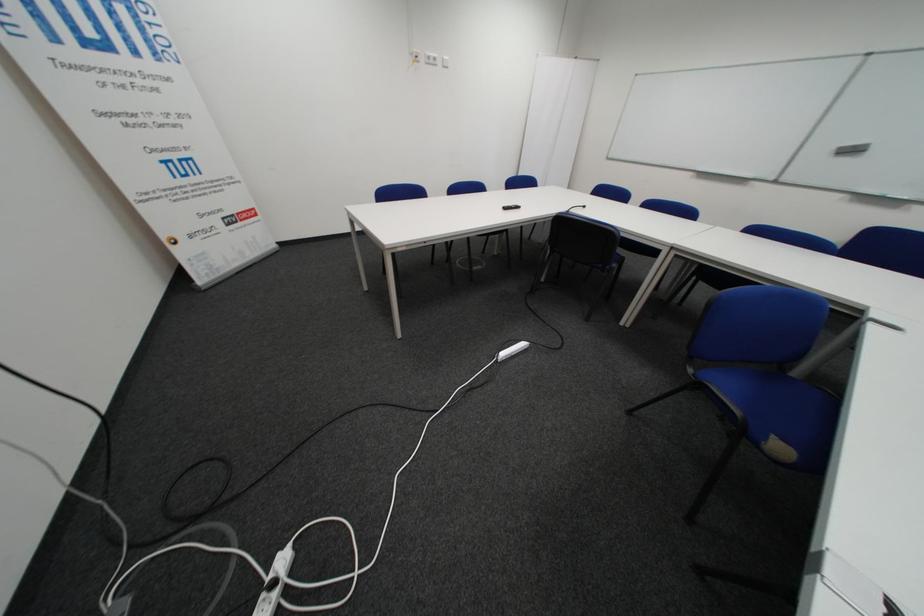
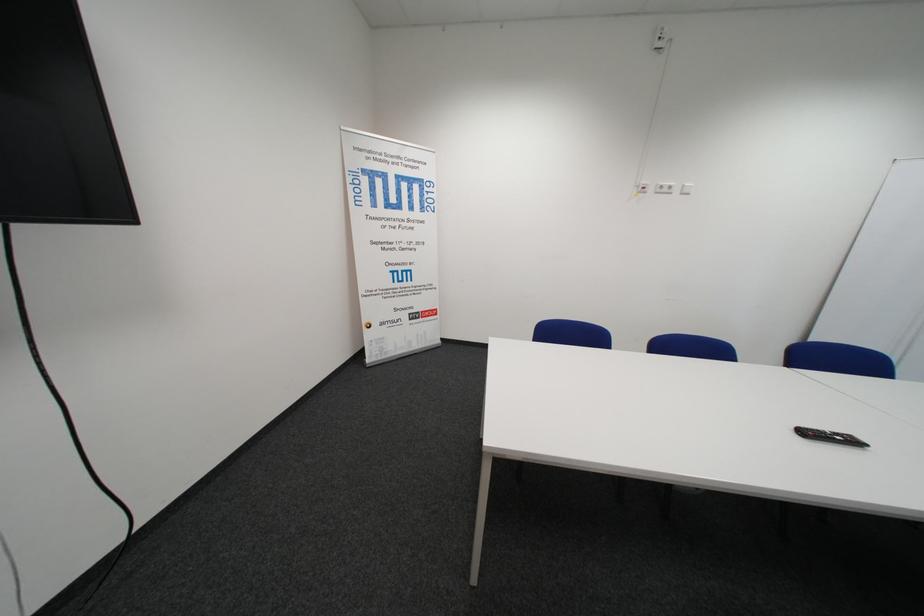
Question: The images are taken continuously from a first-person perspective. In which direction is your viewpoint rotating?

Choices:
 (A) Left
 (B) Right
 (C) Up
 (D) Down

Answer: (A)